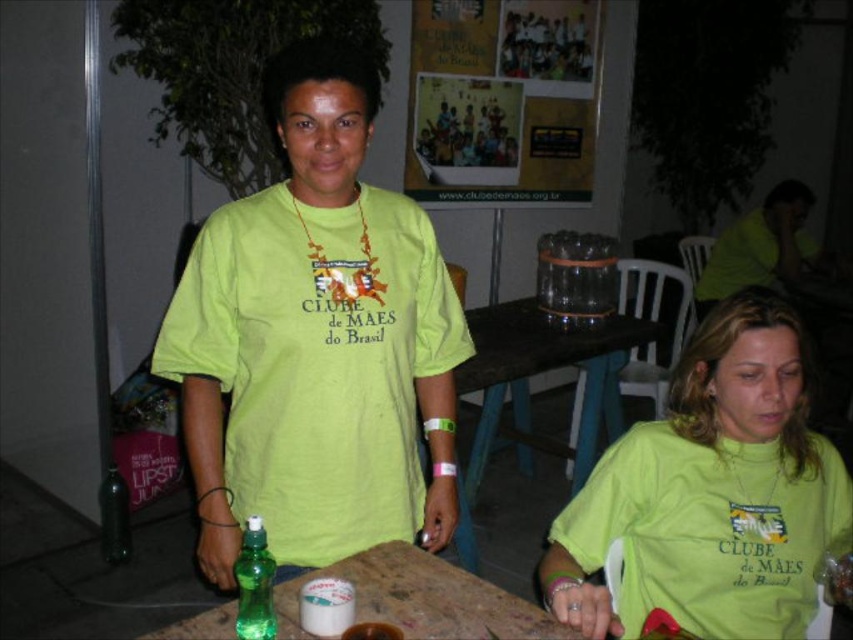
You are organizing a community event and need to place a decorative ribbon on the table. The ribbon is currently hanging from the matte green shirt at upper right. Can you reach the ribbon from the green matte spray bottle at center without moving the spray bottle?

The matte green shirt at upper right is located above the green matte spray bottle at center, so you can reach the ribbon hanging from the matte green shirt at upper right by moving upwards from the spray bottle.

You are standing in front of the wooden table at the event and see two points marked on the table surface. The first point is at coordinate point (741, 282) and the second is at point (239, 634). Which point is closer to you?

Point (741, 282) is closer to you because it is further to the viewer than point (239, 634).